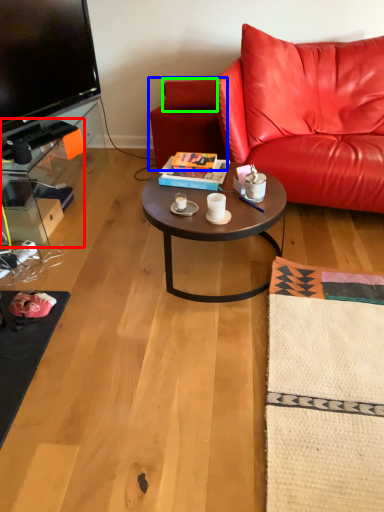
Question: Estimate the real-world distances between objects in this image. Which object is closer to desk (highlighted by a red box), swivel chair (highlighted by a blue box) or pillow (highlighted by a green box)?

Choices:
 (A) swivel chair
 (B) pillow

Answer: (A)